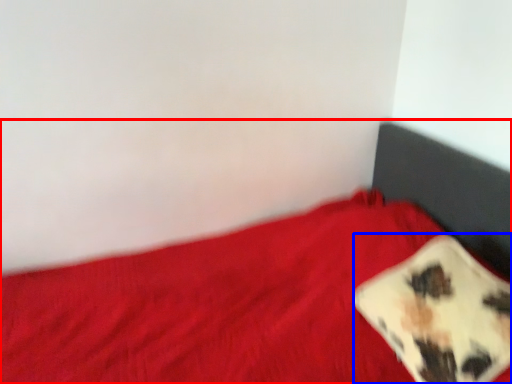
Question: Which object appears closest to the camera in this image, bed (highlighted by a red box) or pillow (highlighted by a blue box)?

Choices:
 (A) bed
 (B) pillow

Answer: (A)